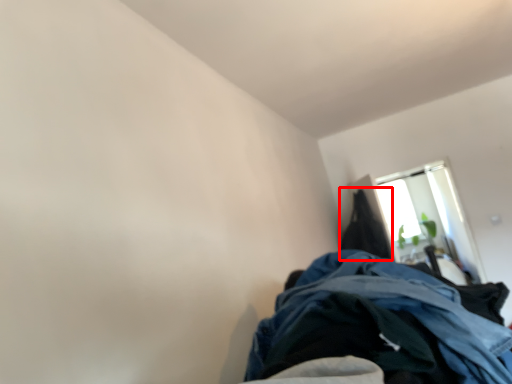
Question: From the image's perspective, where is cloak (annotated by the red box) located relative to window?

Choices:
 (A) below
 (B) above

Answer: (B)